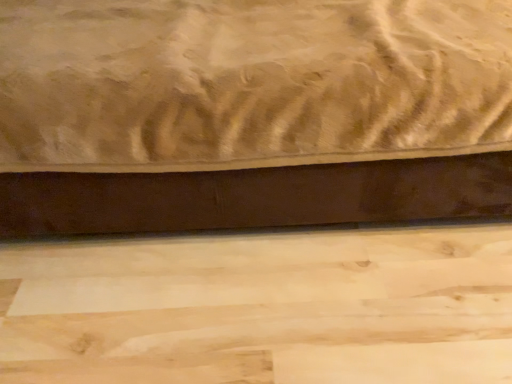
The height and width of the screenshot is (384, 512). Describe the element at coordinates (251, 114) in the screenshot. I see `satin gold mattress at center` at that location.

This screenshot has height=384, width=512. Identify the location of satin gold mattress at center. (251, 114).

The image size is (512, 384). I want to click on satin gold mattress at center, so click(x=251, y=114).